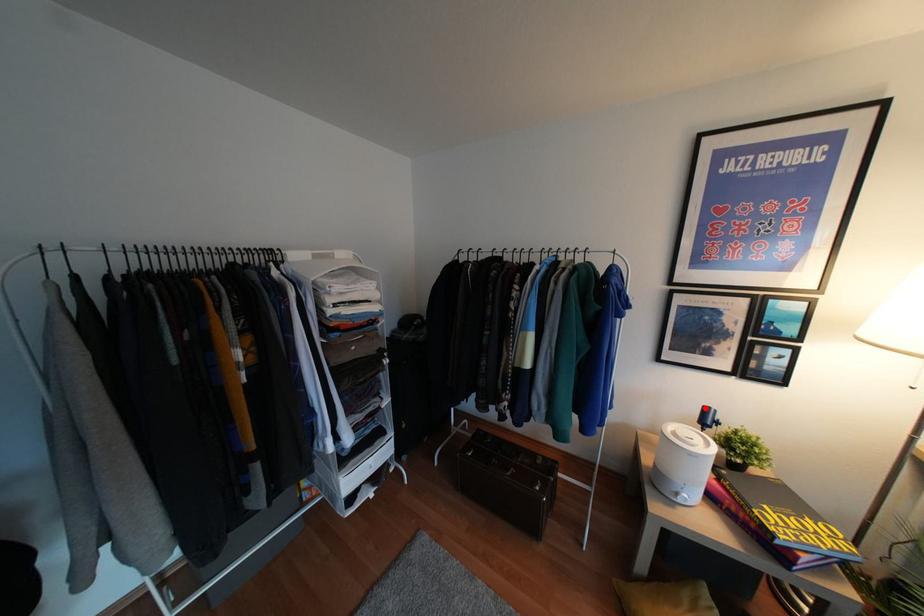
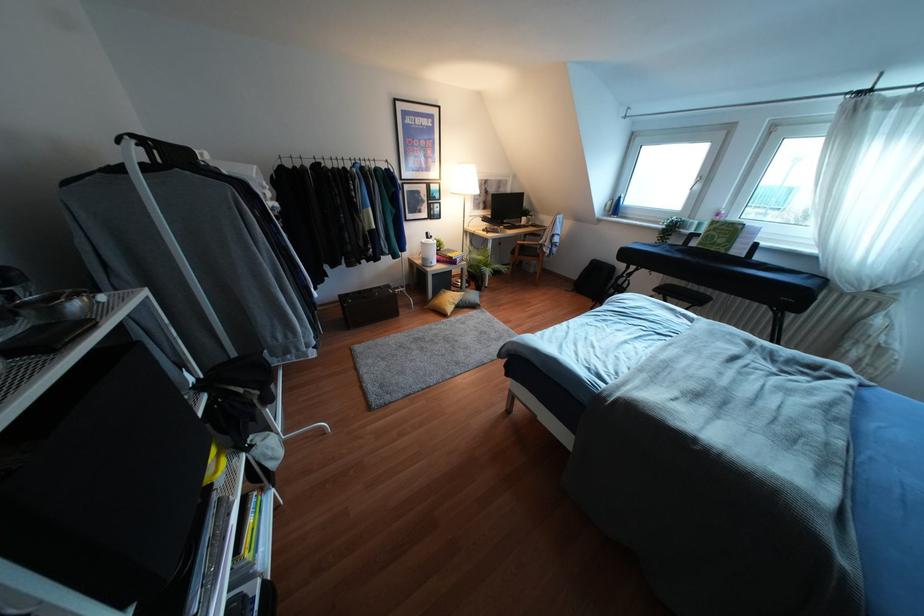
The point at the highlighted location is marked in the first image. Where is the corresponding point in the second image?

(427, 233)